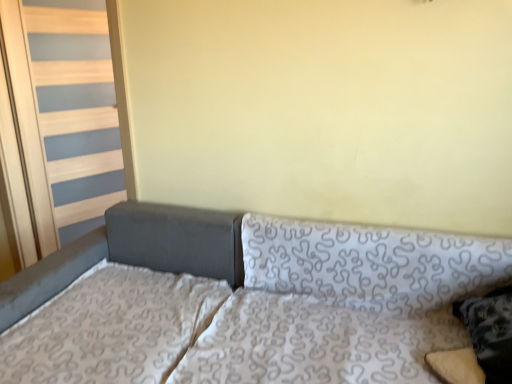
Question: From a real-world perspective, is patterned fabric pillow at right physically above patterned fabric studio couch at center?

Choices:
 (A) no
 (B) yes

Answer: (B)

Question: From the image's perspective, is patterned fabric pillow at right beneath patterned fabric studio couch at center?

Choices:
 (A) yes
 (B) no

Answer: (B)

Question: Is patterned fabric pillow at right looking in the opposite direction of patterned fabric studio couch at center?

Choices:
 (A) no
 (B) yes

Answer: (B)

Question: Considering the relative positions of patterned fabric pillow at right and patterned fabric studio couch at center in the image provided, is patterned fabric pillow at right to the left of patterned fabric studio couch at center from the viewer's perspective?

Choices:
 (A) yes
 (B) no

Answer: (B)

Question: Is patterned fabric pillow at right shorter than patterned fabric studio couch at center?

Choices:
 (A) no
 (B) yes

Answer: (B)

Question: Is patterned fabric pillow at right positioned far away from patterned fabric studio couch at center?

Choices:
 (A) no
 (B) yes

Answer: (A)

Question: Is patterned fabric studio couch at center surrounding patterned fabric pillow at right?

Choices:
 (A) no
 (B) yes

Answer: (B)

Question: Considering the relative positions of patterned fabric studio couch at center and patterned fabric pillow at right in the image provided, is patterned fabric studio couch at center behind patterned fabric pillow at right?

Choices:
 (A) no
 (B) yes

Answer: (A)

Question: Is patterned fabric studio couch at center at the right side of patterned fabric pillow at right?

Choices:
 (A) yes
 (B) no

Answer: (B)

Question: Can you confirm if patterned fabric studio couch at center is shorter than patterned fabric pillow at right?

Choices:
 (A) no
 (B) yes

Answer: (A)

Question: Considering the relative sizes of patterned fabric studio couch at center and patterned fabric pillow at right in the image provided, is patterned fabric studio couch at center thinner than patterned fabric pillow at right?

Choices:
 (A) yes
 (B) no

Answer: (B)

Question: Is patterned fabric studio couch at center to the left of patterned fabric pillow at right from the viewer's perspective?

Choices:
 (A) yes
 (B) no

Answer: (A)

Question: Is patterned fabric mattress at lower left far away from patterned fabric studio couch at center?

Choices:
 (A) no
 (B) yes

Answer: (A)